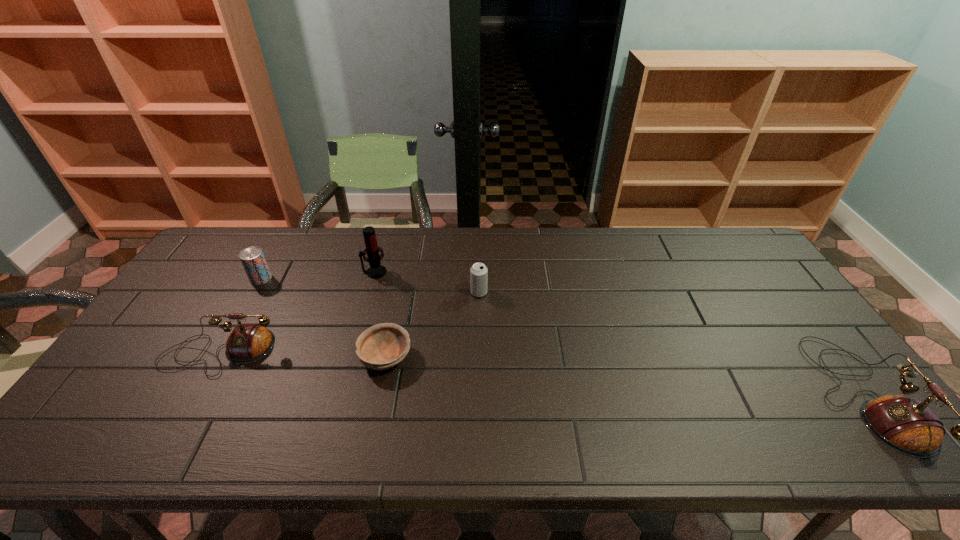
Locate an element on the screen. Image resolution: width=960 pixels, height=540 pixels. vacant area that lies between the microphone and the nearer beer can is located at coordinates (426, 282).

This screenshot has height=540, width=960. What are the coordinates of `free space between the farther beer can and the microphone` in the screenshot? It's located at (318, 275).

The height and width of the screenshot is (540, 960). Identify the location of vacant space in between the left telephone and the microphone. (298, 312).

I want to click on vacant area that lies between the right beer can and the shorter telephone, so click(x=349, y=322).

This screenshot has width=960, height=540. Find the location of `vacant space that is in between the microphone and the farther beer can`. vacant space that is in between the microphone and the farther beer can is located at coordinates (318, 275).

I want to click on free point between the shorter telephone and the shortest object, so click(x=303, y=354).

Where is `vacant area between the nearer beer can and the microphone`? The width and height of the screenshot is (960, 540). vacant area between the nearer beer can and the microphone is located at coordinates (426, 282).

Locate which object ranks third in proximity to the farther beer can. Please provide its 2D coordinates. Your answer should be formatted as a tuple, i.e. [(x, y)], where the tuple contains the x and y coordinates of a point satisfying the conditions above.

[(382, 346)]

Identify which object is the third closest to the right beer can. Please provide its 2D coordinates. Your answer should be formatted as a tuple, i.e. [(x, y)], where the tuple contains the x and y coordinates of a point satisfying the conditions above.

[(248, 342)]

Find the location of `free point that satisfies the following two spatial constraints: 1. on the rotary dial of the shortest object; 2. on the left side of the left telephone`. free point that satisfies the following two spatial constraints: 1. on the rotary dial of the shortest object; 2. on the left side of the left telephone is located at coordinates (218, 356).